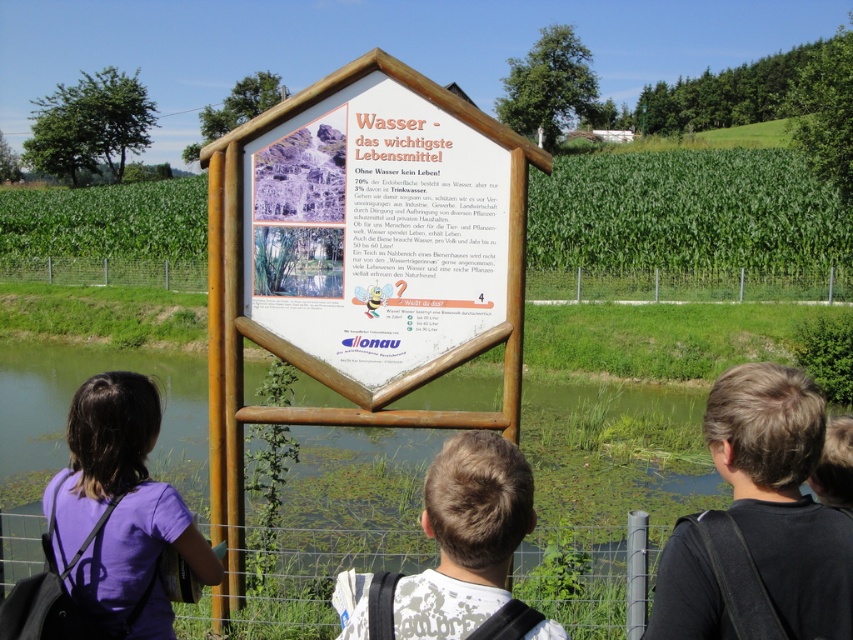
You are a photographer standing at the scene. You want to take a photo of the green grass at center and the wooden fence at center. Which object will appear closer to the camera in the photo?

The green grass at center is in front of the wooden fence at center, so it will appear closer to the camera in the photo.

Based on the photo, you are standing at the point with coordinates (x=314, y=573). What object is located at this point?

The wire mesh fence at lower center is located at point (x=314, y=573).